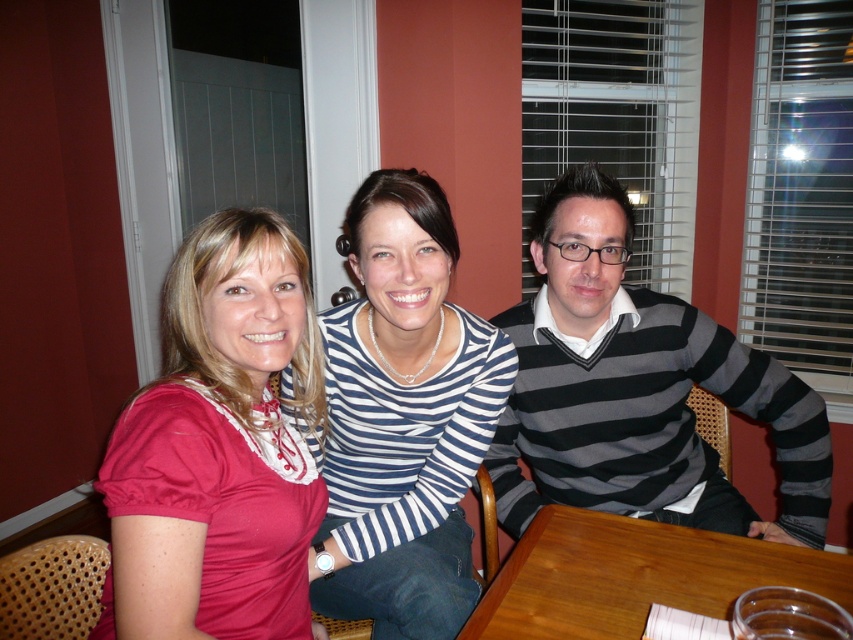
Question: Among these points, which one is farthest from the camera?

Choices:
 (A) (540, 262)
 (B) (431, 384)
 (C) (776, 579)

Answer: (A)

Question: Which of the following is the closest to the observer?

Choices:
 (A) (666, 534)
 (B) (312, 419)

Answer: (B)

Question: Estimate the real-world distances between objects in this image. Which object is closer to the striped sweater at center?

Choices:
 (A) wooden table at center
 (B) striped knit sweater at center
 (C) satin red blouse at left

Answer: (A)

Question: From the image, what is the correct spatial relationship of satin red blouse at left in relation to striped sweater at center?

Choices:
 (A) below
 (B) above

Answer: (A)

Question: Is satin red blouse at left above wooden table at center?

Choices:
 (A) yes
 (B) no

Answer: (A)

Question: Is satin red blouse at left further to the viewer compared to striped sweater at center?

Choices:
 (A) no
 (B) yes

Answer: (A)